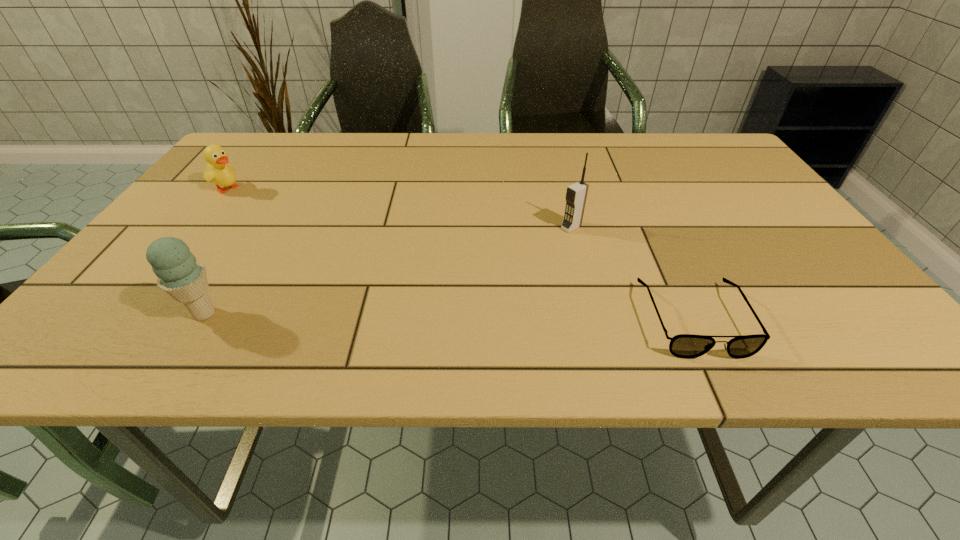
This screenshot has height=540, width=960. In order to click on vacant space on the desktop that is between the third object from right to left and the rightmost object and is positioned on the front-facing side of the third object from left to right in this screenshot , I will do `click(415, 316)`.

Locate an element on the screen. The image size is (960, 540). vacant space on the desktop that is between the ice cream and the rightmost object and is positioned on the front-facing side of the second shortest object is located at coordinates (467, 316).